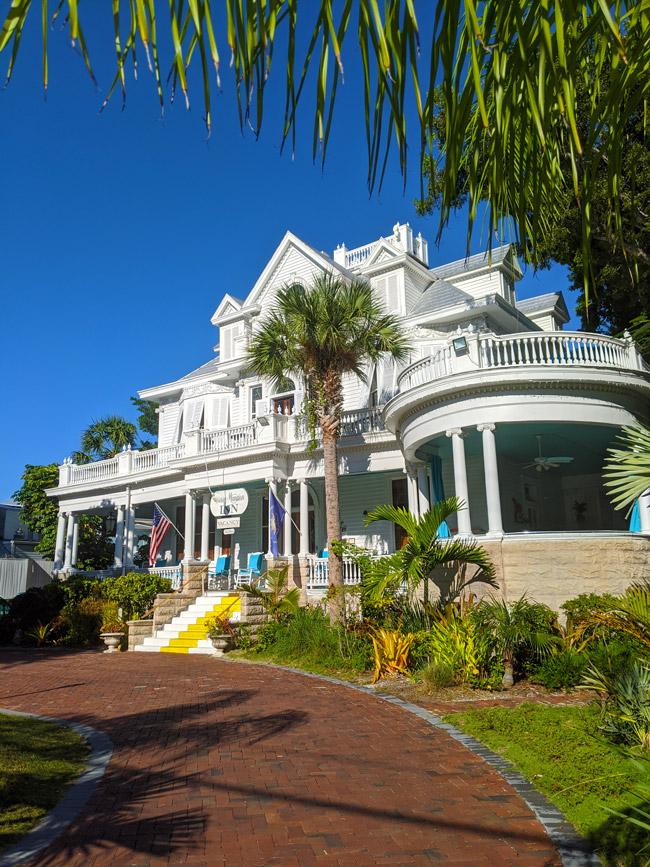
Identify the location of baby blue rocking chairs. The image size is (650, 867). (251, 558), (222, 561), (324, 551).